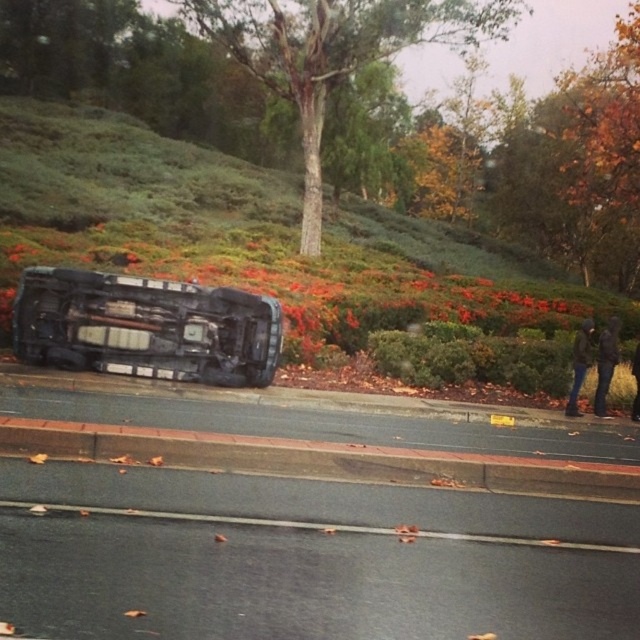
Question: Which point appears closest to the camera in this image?

Choices:
 (A) (346, 412)
 (B) (188, 300)
 (C) (298, 452)

Answer: (C)

Question: Is green shrubbery at upper left to the left of concrete at lower center from the viewer's perspective?

Choices:
 (A) no
 (B) yes

Answer: (B)

Question: Does green shrubbery at upper left have a greater width compared to smooth bark tree at center?

Choices:
 (A) yes
 (B) no

Answer: (A)

Question: Which point is closer to the camera taking this photo?

Choices:
 (A) (536, 410)
 (B) (211, 342)

Answer: (B)

Question: Is green shrubbery at upper left to the right of brick-red concrete curb at lower center from the viewer's perspective?

Choices:
 (A) no
 (B) yes

Answer: (A)

Question: Which point is closer to the camera?

Choices:
 (A) concrete at lower center
 (B) brick-red concrete curb at lower center

Answer: (B)